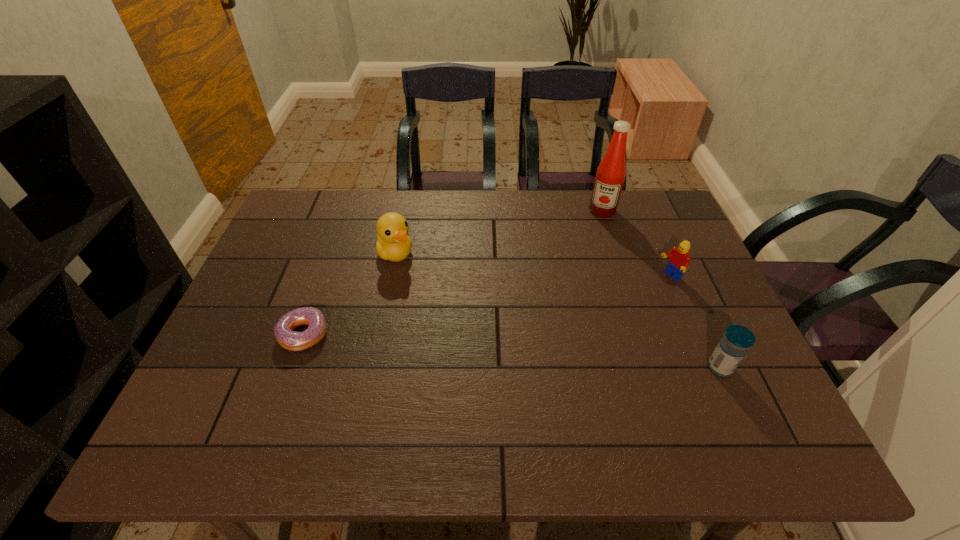
Where is `object situated at the near edge`? object situated at the near edge is located at coordinates (733, 346).

I want to click on object that is at the left edge, so click(x=294, y=341).

Where is `medicine that is at the right edge`? The width and height of the screenshot is (960, 540). medicine that is at the right edge is located at coordinates (733, 346).

Where is `Lego that is at the right edge`? Lego that is at the right edge is located at coordinates (679, 260).

Locate an element on the screen. Image resolution: width=960 pixels, height=540 pixels. object present at the near right corner is located at coordinates [733, 346].

Identify the location of vacant space at the far edge. (483, 231).

In the image, there is a desktop. At what (x,y) coordinates should I click in order to perform the action: click on vacant space at the left edge. Please return your answer as a coordinate pair (x, y). Looking at the image, I should click on (312, 237).

You are a GUI agent. You are given a task and a screenshot of the screen. Output one action in this format:
    pyautogui.click(x=<x>, y=<y>)
    Task: Click on the vacant space at the right edge of the desktop
    Image resolution: width=960 pixels, height=540 pixels.
    Given the screenshot: What is the action you would take?
    pyautogui.click(x=697, y=334)

I want to click on blank space at the far left corner, so click(305, 213).

In order to click on vacant area at the far right corner of the desktop in this screenshot , I will do `click(634, 231)`.